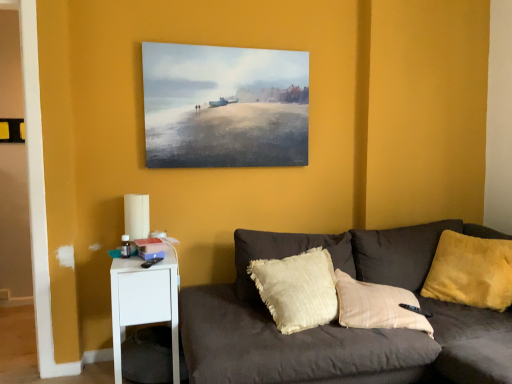
Describe the element at coordinates (136, 216) in the screenshot. I see `white paper lampshade at left` at that location.

Describe the element at coordinates (145, 301) in the screenshot. I see `white plastic nightstand at lower left` at that location.

Measure the distance between dark gray fabric couch at lower right and camera.

1.58 meters.

Image resolution: width=512 pixels, height=384 pixels. I want to click on white paper lampshade at left, so click(x=136, y=216).

Considering the sizes of objects white paper lampshade at left and white plastic nightstand at lower left in the image provided, who is bigger, white paper lampshade at left or white plastic nightstand at lower left?

white plastic nightstand at lower left.

I want to click on lamp above the white plastic nightstand at lower left (from the image's perspective), so click(136, 216).

Based on the photo, which of these two, white paper lampshade at left or white plastic nightstand at lower left, stands shorter?

white paper lampshade at left is shorter.

Looking at this image, is yellow plush pillow at right oriented away from white paper lampshade at left?

That's not correct — yellow plush pillow at right is not looking away from white paper lampshade at left.

In terms of width, does yellow plush pillow at right look wider or thinner when compared to white paper lampshade at left?

Considering their sizes, yellow plush pillow at right looks broader than white paper lampshade at left.

From the image's perspective, between yellow plush pillow at right and white paper lampshade at left, which one is located above?

white paper lampshade at left appears higher in the image.

Can white paper lampshade at left be found inside yellow plush pillow at right?

No, white paper lampshade at left is not a part of yellow plush pillow at right.

Is there a large distance between white paper lampshade at left and dark gray fabric couch at lower right?

They are positioned close to each other.

Can you confirm if white paper lampshade at left is positioned to the right of dark gray fabric couch at lower right?

No, white paper lampshade at left is not to the right of dark gray fabric couch at lower right.

What's the angular difference between white paper lampshade at left and dark gray fabric couch at lower right's facing directions?

The facing directions of white paper lampshade at left and dark gray fabric couch at lower right are 97.1 degrees apart.

Is white paper lampshade at left taller or shorter than dark gray fabric couch at lower right?

Clearly, white paper lampshade at left is shorter compared to dark gray fabric couch at lower right.

From the image's perspective, which one is positioned lower, white plastic nightstand at lower left or dark gray fabric couch at lower right?

white plastic nightstand at lower left.

How distant is white plastic nightstand at lower left from dark gray fabric couch at lower right?

20.61 inches.

Is white plastic nightstand at lower left aimed at dark gray fabric couch at lower right?

No, white plastic nightstand at lower left is not facing towards dark gray fabric couch at lower right.

What's the angular difference between white plastic nightstand at lower left and dark gray fabric couch at lower right's facing directions?

The angular difference between white plastic nightstand at lower left and dark gray fabric couch at lower right is 87.5 degrees.

Looking at this image, is watercolor painting at upper center with yellow plush pillow at right?

There is a gap between watercolor painting at upper center and yellow plush pillow at right.

From the image's perspective, is watercolor painting at upper center positioned above or below yellow plush pillow at right?

Based on their image positions, watercolor painting at upper center is located above yellow plush pillow at right.

Looking at this image, from a real-world perspective, relative to yellow plush pillow at right, is watercolor painting at upper center vertically above or below?

watercolor painting at upper center is situated higher than yellow plush pillow at right in the real world.

Considering the relative sizes of watercolor painting at upper center and yellow plush pillow at right in the image provided, is watercolor painting at upper center bigger than yellow plush pillow at right?

No.

Is yellow plush pillow at right oriented towards watercolor painting at upper center?

No.

Is yellow plush pillow at right in front of or behind watercolor painting at upper center in the image?

yellow plush pillow at right is in front of watercolor painting at upper center.

Is yellow plush pillow at right to the right of watercolor painting at upper center from the viewer's perspective?

Yes, yellow plush pillow at right is to the right of watercolor painting at upper center.

Is dark gray fabric couch at lower right inside or outside of yellow plush pillow at right?

dark gray fabric couch at lower right is located beyond the bounds of yellow plush pillow at right.

Which point is more distant from viewer, [496,361] or [480,252]?

The point [480,252] is more distant.

Is dark gray fabric couch at lower right facing towards yellow plush pillow at right?

No, dark gray fabric couch at lower right is not aimed at yellow plush pillow at right.

In the image, is dark gray fabric couch at lower right positioned in front of or behind yellow plush pillow at right?

dark gray fabric couch at lower right is positioned closer to the viewer than yellow plush pillow at right.

Locate an element on the screen. nightstand directly beneath the white paper lampshade at left (from a real-world perspective) is located at coordinates (145, 301).

Where is `lamp above the yellow plush pillow at right (from a real-world perspective)`? lamp above the yellow plush pillow at right (from a real-world perspective) is located at coordinates (136, 216).

When comparing their distances from white paper lampshade at left, does dark gray fabric couch at lower right or watercolor painting at upper center seem further?

dark gray fabric couch at lower right is positioned further to the anchor white paper lampshade at left.

Estimate the real-world distances between objects in this image. Which object is further from white plastic nightstand at lower left, white paper lampshade at left or yellow plush pillow at right?

Based on the image, yellow plush pillow at right appears to be further to white plastic nightstand at lower left.

Considering their positions, is dark gray fabric couch at lower right positioned further to yellow plush pillow at right than white plastic nightstand at lower left?

white plastic nightstand at lower left lies further to yellow plush pillow at right than the other object.

Looking at the image, which one is located closer to white paper lampshade at left, dark gray fabric couch at lower right or white plastic nightstand at lower left?

white plastic nightstand at lower left.

When comparing their distances from yellow plush pillow at right, does watercolor painting at upper center or white plastic nightstand at lower left seem closer?

watercolor painting at upper center lies closer to yellow plush pillow at right than the other object.

Which object lies nearer to the anchor point dark gray fabric couch at lower right, watercolor painting at upper center or yellow plush pillow at right?

yellow plush pillow at right lies closer to dark gray fabric couch at lower right than the other object.

Based on the photo, which object lies nearer to the anchor point white plastic nightstand at lower left, dark gray fabric couch at lower right or watercolor painting at upper center?

Among the two, dark gray fabric couch at lower right is located nearer to white plastic nightstand at lower left.

Based on their spatial positions, is white plastic nightstand at lower left or watercolor painting at upper center closer to yellow plush pillow at right?

Among the two, watercolor painting at upper center is located nearer to yellow plush pillow at right.

This screenshot has height=384, width=512. In order to click on studio couch between white plastic nightstand at lower left and yellow plush pillow at right in this screenshot , I will do `click(338, 324)`.

Locate an element on the screen. This screenshot has width=512, height=384. picture frame between white paper lampshade at left and yellow plush pillow at right from left to right is located at coordinates (224, 106).

At what (x,y) coordinates should I click in order to perform the action: click on studio couch between watercolor painting at upper center and yellow plush pillow at right. Please return your answer as a coordinate pair (x, y). This screenshot has height=384, width=512. Looking at the image, I should click on (338, 324).

Identify the location of lamp positioned between dark gray fabric couch at lower right and watercolor painting at upper center from near to far. (136, 216).